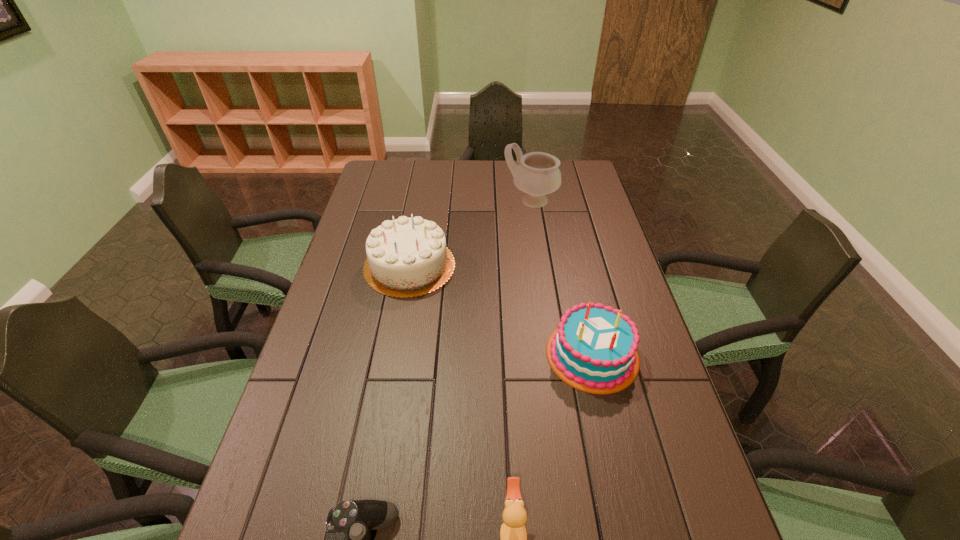
Find the location of a particular element. The height and width of the screenshot is (540, 960). pottery is located at coordinates (538, 174).

The width and height of the screenshot is (960, 540). Find the location of `the farthest object`. the farthest object is located at coordinates (538, 174).

Identify the location of the second farthest object. (407, 257).

This screenshot has width=960, height=540. What are the coordinates of `the farther birthday cake` in the screenshot? It's located at (407, 257).

This screenshot has height=540, width=960. Find the location of `the third nearest object`. the third nearest object is located at coordinates (593, 348).

The height and width of the screenshot is (540, 960). I want to click on the nearer birthday cake, so click(593, 348).

Where is `vacant point located 0.350m on the front of the farthest object`? The height and width of the screenshot is (540, 960). vacant point located 0.350m on the front of the farthest object is located at coordinates (542, 280).

Identify the location of vacant space situated 0.140m on the front of the fourth nearest object. The width and height of the screenshot is (960, 540). (397, 335).

Find the location of a particular element. The width and height of the screenshot is (960, 540). free space located on the left of the third farthest object is located at coordinates (521, 354).

This screenshot has height=540, width=960. What are the coordinates of `object that is at the far edge` in the screenshot? It's located at (538, 174).